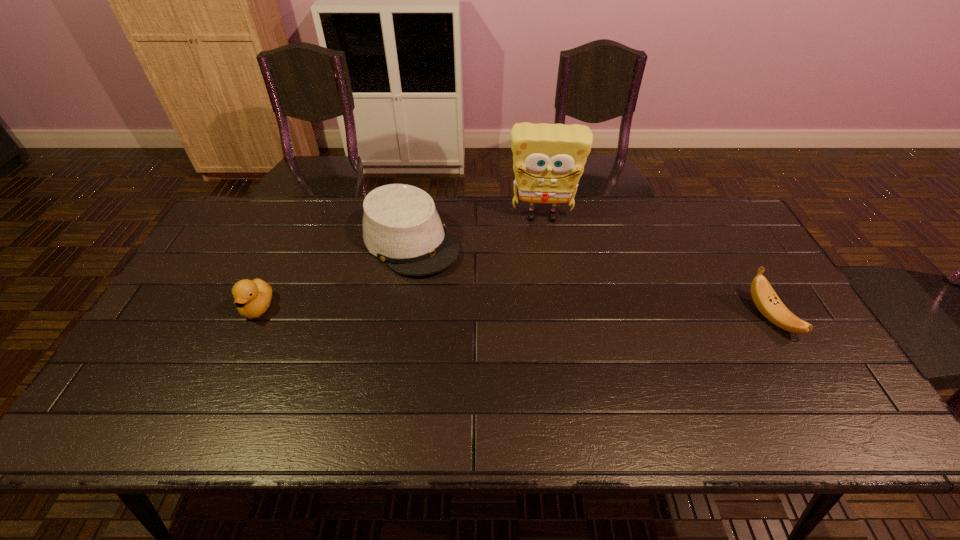
You are a GUI agent. You are given a task and a screenshot of the screen. Output one action in this format:
    pyautogui.click(x=<x>, y=<y>)
    Task: Click on the vacant space situated on the face of the tallest object
    
    Given the screenshot: What is the action you would take?
    pyautogui.click(x=543, y=295)

You are a GUI agent. You are given a task and a screenshot of the screen. Output one action in this format:
    pyautogui.click(x=<x>, y=<y>)
    Task: Click on the vacant space located on the face of the tallest object
    
    Given the screenshot: What is the action you would take?
    pyautogui.click(x=543, y=295)

What are the coordinates of `vacant area situated on the face of the tallest object` in the screenshot? It's located at (544, 314).

This screenshot has width=960, height=540. I want to click on hat at the far edge, so click(401, 227).

Find the location of `sponge present at the far edge`. sponge present at the far edge is located at coordinates (548, 159).

What are the coordinates of `object at the right edge` in the screenshot? It's located at (765, 298).

In the image, there is a desktop. Find the location of `free space at the far edge`. free space at the far edge is located at coordinates (542, 213).

I want to click on free space at the near edge of the desktop, so click(x=754, y=382).

In the image, there is a desktop. Where is `vacant space at the left edge`? The width and height of the screenshot is (960, 540). vacant space at the left edge is located at coordinates (206, 258).

The height and width of the screenshot is (540, 960). Identify the location of blank space at the far left corner. (271, 217).